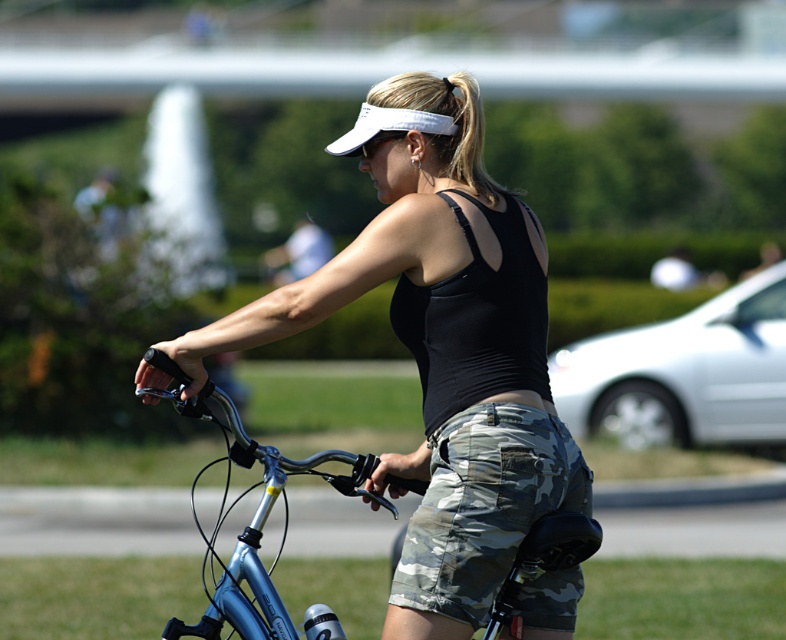
Between metallic blue bicycle at center and white fabric visor at upper center, which one has more height?

Standing taller between the two is white fabric visor at upper center.

Does metallic blue bicycle at center have a greater height compared to white fabric visor at upper center?

Incorrect, metallic blue bicycle at center's height is not larger of white fabric visor at upper center's.

Where is `metallic blue bicycle at center`? metallic blue bicycle at center is located at coordinates (255, 512).

Is camo fabric shorts at center below white fabric visor at upper center?

Yes.

Is point (518, 412) positioned before point (450, 125)?

Yes.

The width and height of the screenshot is (786, 640). In order to click on camo fabric shorts at center in this screenshot , I will do `click(476, 512)`.

Can you confirm if black matte tank top at center is shorter than metallic blue bicycle at center?

Yes, black matte tank top at center is shorter than metallic blue bicycle at center.

Does point (410, 314) come in front of point (186, 413)?

Yes, point (410, 314) is in front of point (186, 413).

Based on the photo, who is more forward, (502, 221) or (534, 536)?

Point (534, 536) is more forward.

This screenshot has width=786, height=640. I want to click on black matte tank top at center, so click(476, 321).